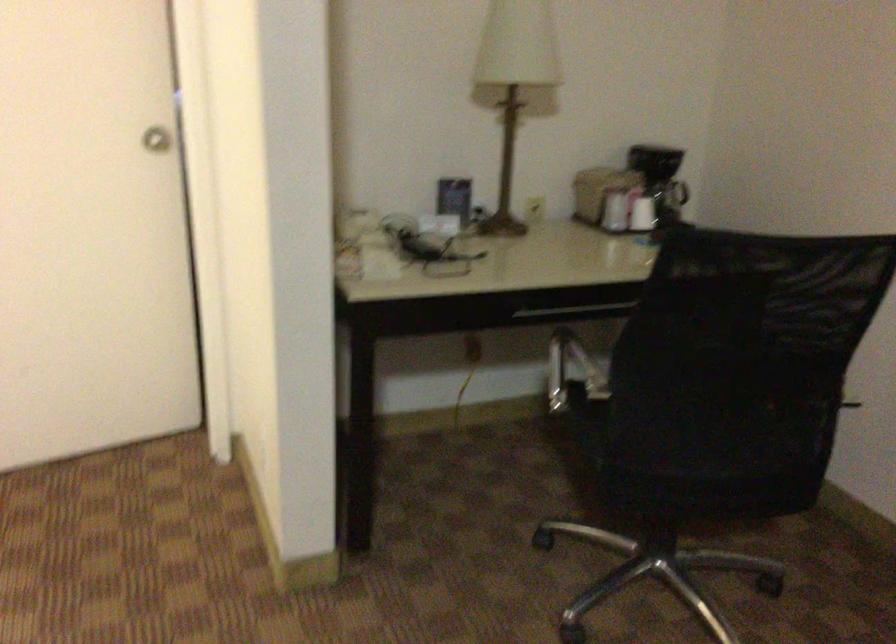
Find the location of `coffee carafe handle`. coffee carafe handle is located at coordinates (677, 202).